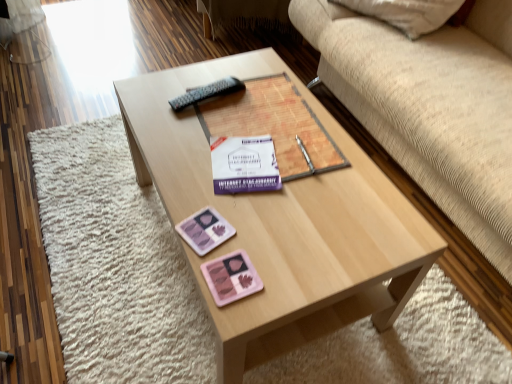
The image size is (512, 384). What are the coordinates of `free spot above white paper at center (from a real-world perspective)` in the screenshot? It's located at (244, 170).